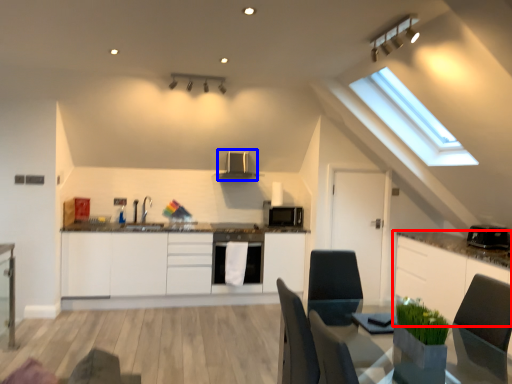
Question: Which point is closer to the camera, cabinetry (highlighted by a red box) or exhaust hood (highlighted by a blue box)?

Choices:
 (A) cabinetry
 (B) exhaust hood

Answer: (A)